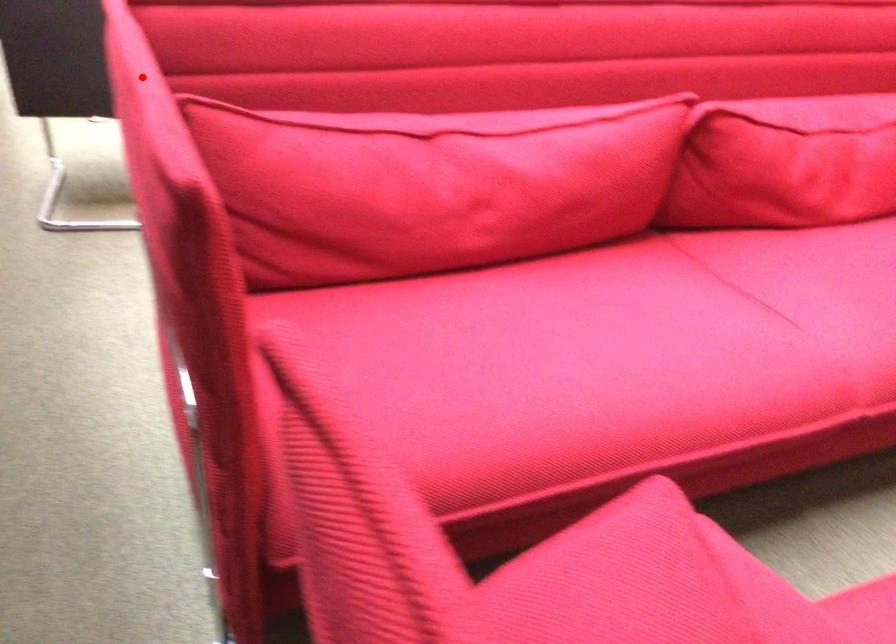
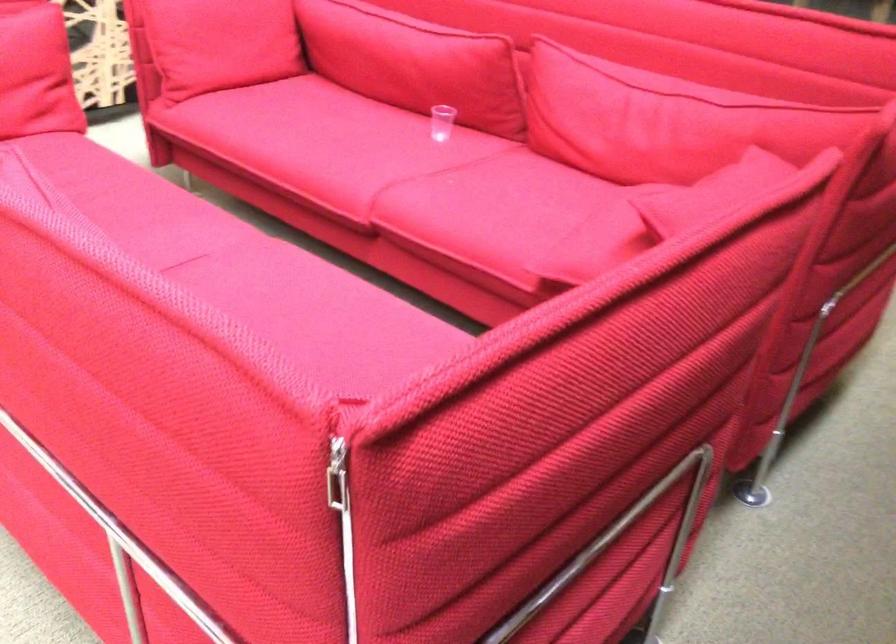
The point at the highlighted location is marked in the first image. Where is the corresponding point in the second image?

(691, 222)